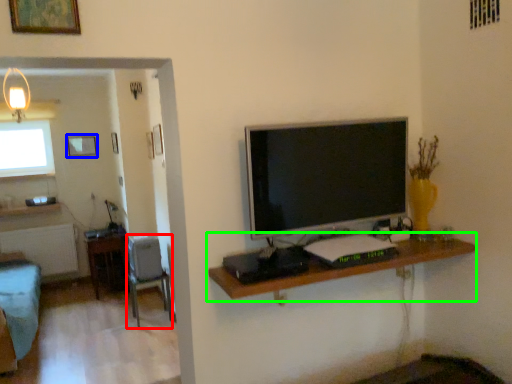
Question: Based on their relative distances, which object is nearer to chair (highlighted by a red box)? Choose from picture frame (highlighted by a blue box) and shelf (highlighted by a green box).

Choices:
 (A) picture frame
 (B) shelf

Answer: (A)